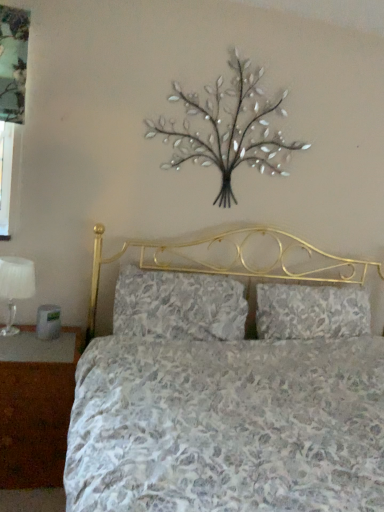
Where is `free spot to the left of metallic gray alarm clock at left`? free spot to the left of metallic gray alarm clock at left is located at coordinates (14, 333).